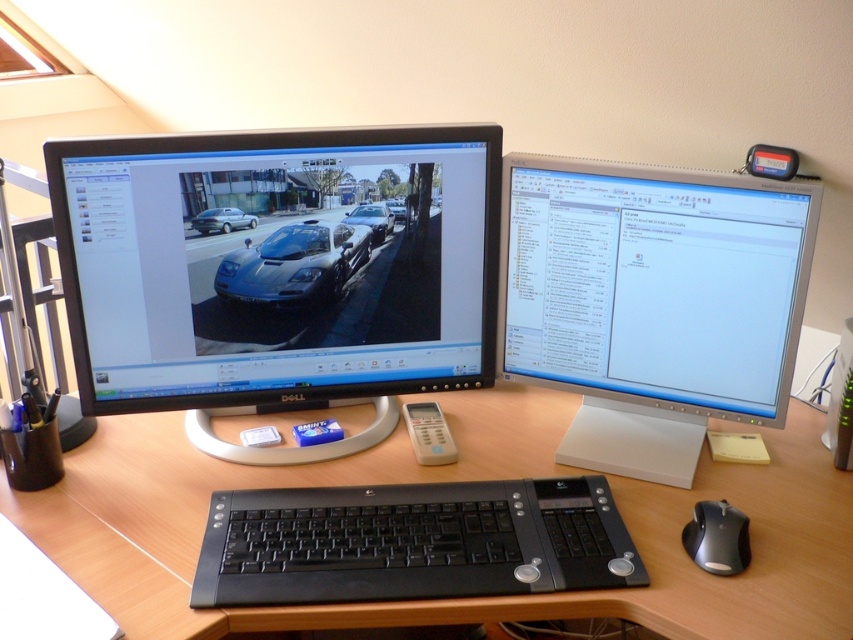
Looking at the workstation setup, where is the satin silver monitor at upper right located relative to the glossy carbon fiber sports car at center?

The satin silver monitor at upper right is located to the right of the glossy carbon fiber sports car at center.

From the picture: You are a delivery person who needs to place a package that is 5 inches wide between the black glossy monitor at left and the glossy carbon fiber sports car at center. Can the package fit in the space between them?

The distance between the black glossy monitor at left and the glossy carbon fiber sports car at center is 4.19 inches. Since the package is 5 inches wide, it cannot fit in the space between them.

You are a person with a height of 1.7 meters standing at the desk. You need to reach the black glossy monitor at left to adjust its settings. Can you comfortably reach it without moving your feet?

The black glossy monitor at left is 1.04 meters away from viewer. Since the average comfortable reach for a person of this height is about 0.8 meters, you might need to step closer or move your feet to adjust it comfortably.